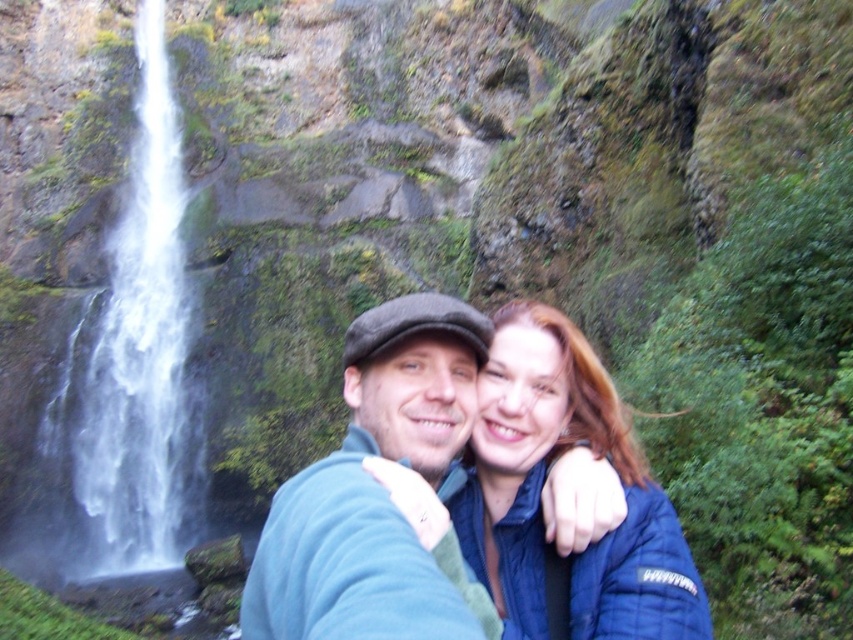
Question: Which object is the closest to the blue quilted jacket at center?

Choices:
 (A) blue fleece jacket at center
 (B) white frothy water at left

Answer: (A)

Question: Among these points, which one is nearest to the camera?

Choices:
 (A) (91, 502)
 (B) (521, 408)
 (C) (410, 307)

Answer: (C)

Question: Which is farther from the blue fleece jacket at center?

Choices:
 (A) white frothy water at left
 (B) blue quilted jacket at center

Answer: (A)

Question: Does blue fleece jacket at center have a smaller size compared to blue quilted jacket at center?

Choices:
 (A) no
 (B) yes

Answer: (A)

Question: Can you confirm if blue quilted jacket at center is bigger than white frothy water at left?

Choices:
 (A) no
 (B) yes

Answer: (A)

Question: Can you confirm if blue fleece jacket at center is positioned below white frothy water at left?

Choices:
 (A) no
 (B) yes

Answer: (B)